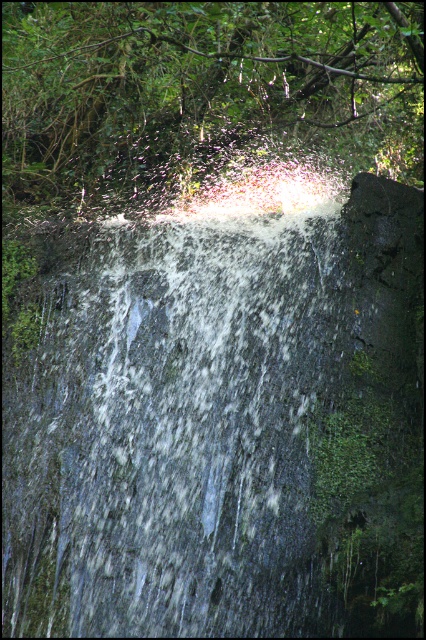
Question: Which point is closer to the camera taking this photo?

Choices:
 (A) (354, 627)
 (B) (330, 90)

Answer: (A)

Question: Which object appears closest to the camera in this image?

Choices:
 (A) translucent glass waterfall at center
 (B) green leafy tree at upper center

Answer: (A)

Question: Which point appears farthest from the camera in this image?

Choices:
 (A) (213, 342)
 (B) (37, 115)

Answer: (B)

Question: Is translucent glass waterfall at center positioned at the back of green leafy tree at upper center?

Choices:
 (A) no
 (B) yes

Answer: (A)

Question: Is translucent glass waterfall at center further to camera compared to green leafy tree at upper center?

Choices:
 (A) yes
 (B) no

Answer: (B)

Question: Does translucent glass waterfall at center have a smaller size compared to green leafy tree at upper center?

Choices:
 (A) no
 (B) yes

Answer: (A)